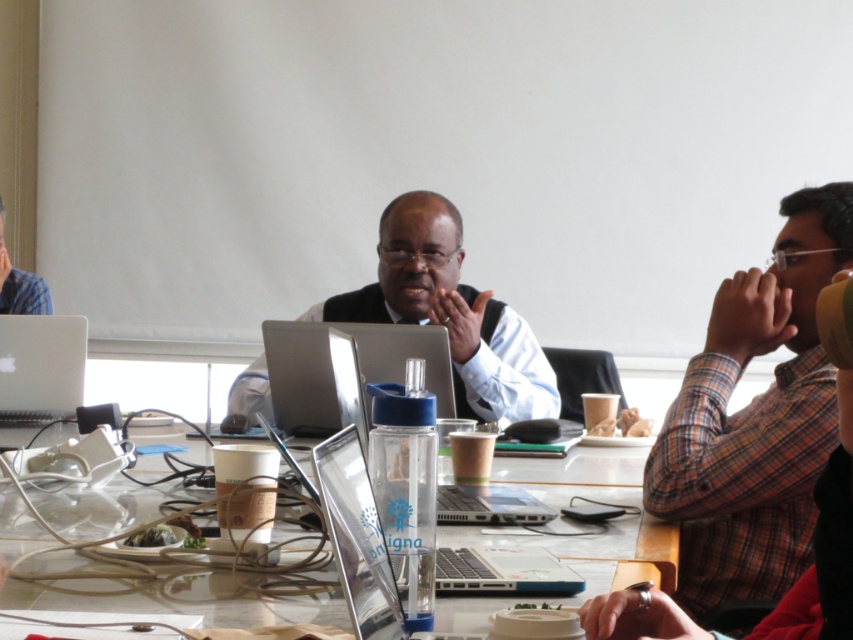
You are organizing a meeting and need to place a new item between the plaid shirt at right and the clear plastic water bottle at center. Based on their sizes, which object should the new item be closer to?

The plaid shirt at right has a smaller size compared to the clear plastic water bottle at center, so the new item should be placed closer to the plaid shirt at right to maintain balance between the two objects.

You are organizing a meeting and need to place a new name tag for a guest. The name tag must be placed to the left of the clear plastic water bottle at center. Where should you place it in relation to the plaid shirt at right?

The plaid shirt at right is positioned on the right side of clear plastic water bottle at center, so the name tag should be placed to the left of the clear plastic water bottle at center, which would be the opposite side of the plaid shirt at right.

You are organizing a workshop and need to place a 4 inch wide notebook between the silver metallic laptop at center and the clear plastic laptop at center. Is there enough space between them to fit the notebook?

The silver metallic laptop at center and the clear plastic laptop at center are 3.98 inches apart. Since the notebook is 4 inches wide, it will not fit between them as the space is slightly narrower.